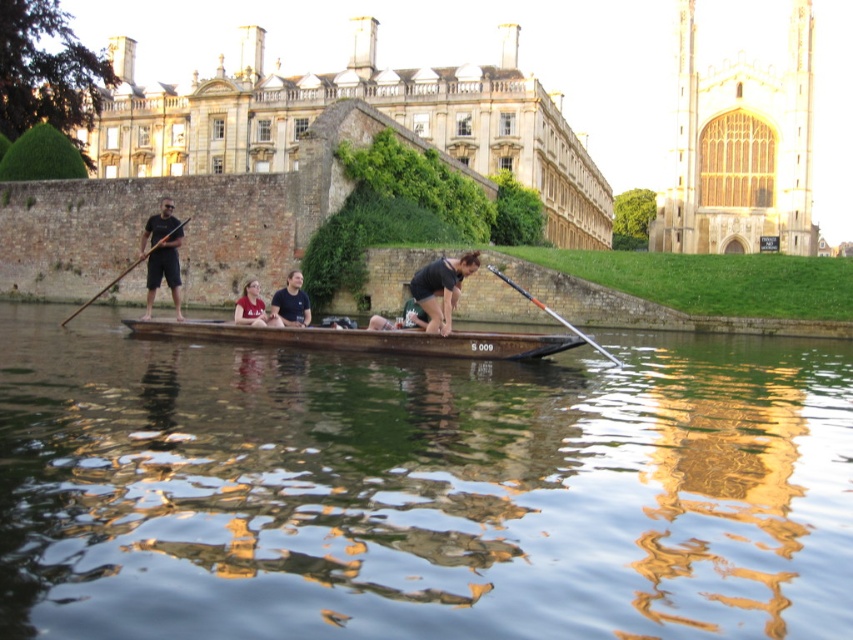
You are standing on the riverbank and see the brown wooden boat at center. If you want to throw a lifebuoy to someone on the boat, which is 114.93 feet away, would you need to aim higher or lower than the boat to compensate for the distance?

To compensate for the distance of 114.93 feet, you would need to aim higher than the brown wooden boat at center because the lifebuoy will follow a parabolic trajectory, requiring a higher arc to reach the target accurately.

You are an architect analyzing the proportions of the scene. Given the stone building at upper center and the wooden paddle at left, which object appears wider in the image?

The stone building at upper center appears wider than the wooden paddle at left because its width surpasses that of the wooden paddle at left.